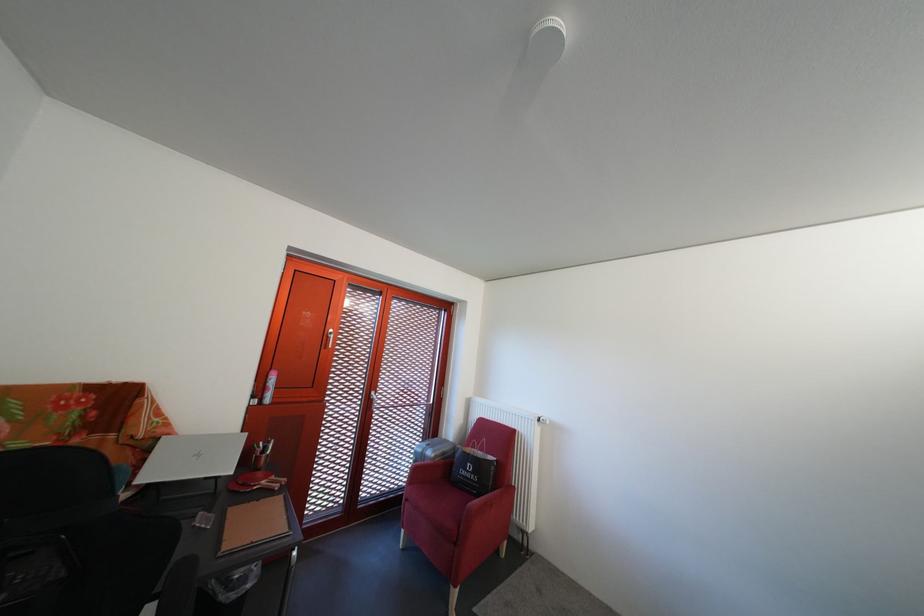
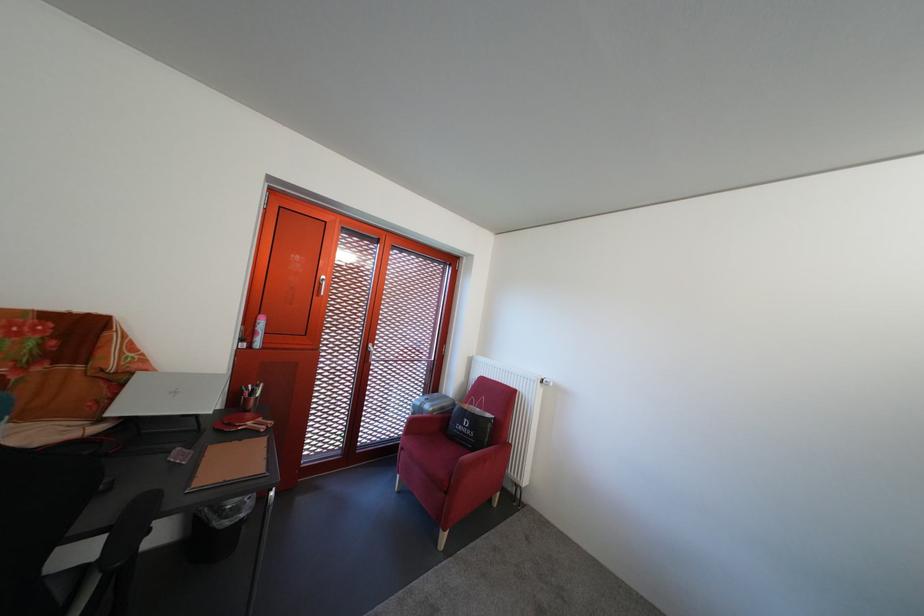
In the second image, find the point that corresponds to point 263,403 in the first image.

(252, 346)